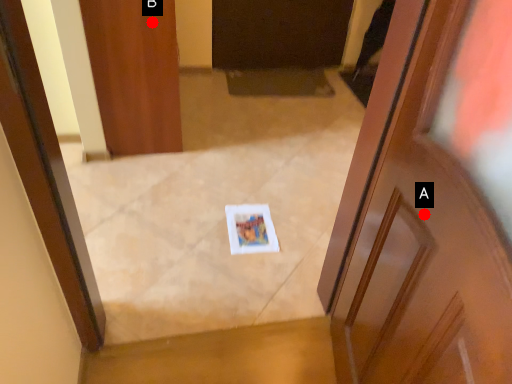
Question: Two points are circled on the image, labeled by A and B beside each circle. Which point is closer to the camera?

Choices:
 (A) A is closer
 (B) B is closer

Answer: (A)